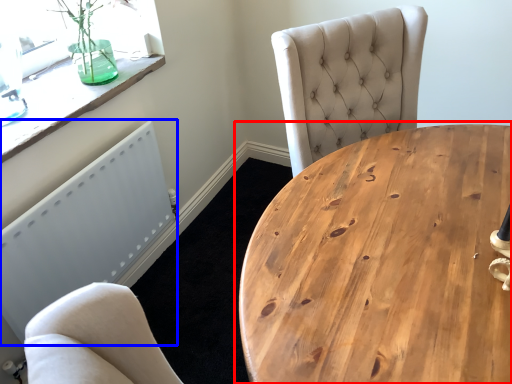
Question: Which point is further to the camera, coffee table (highlighted by a red box) or radiator (highlighted by a blue box)?

Choices:
 (A) coffee table
 (B) radiator

Answer: (B)